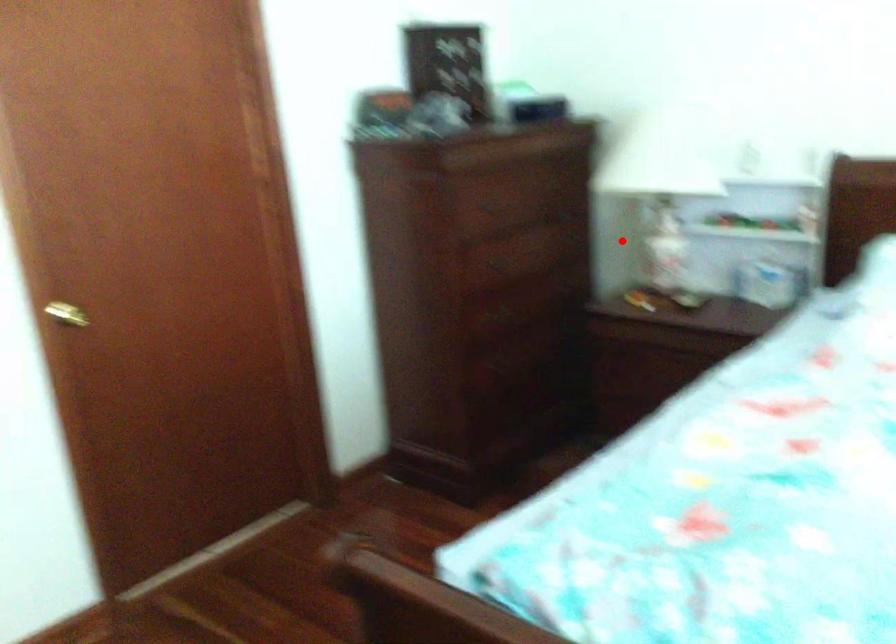
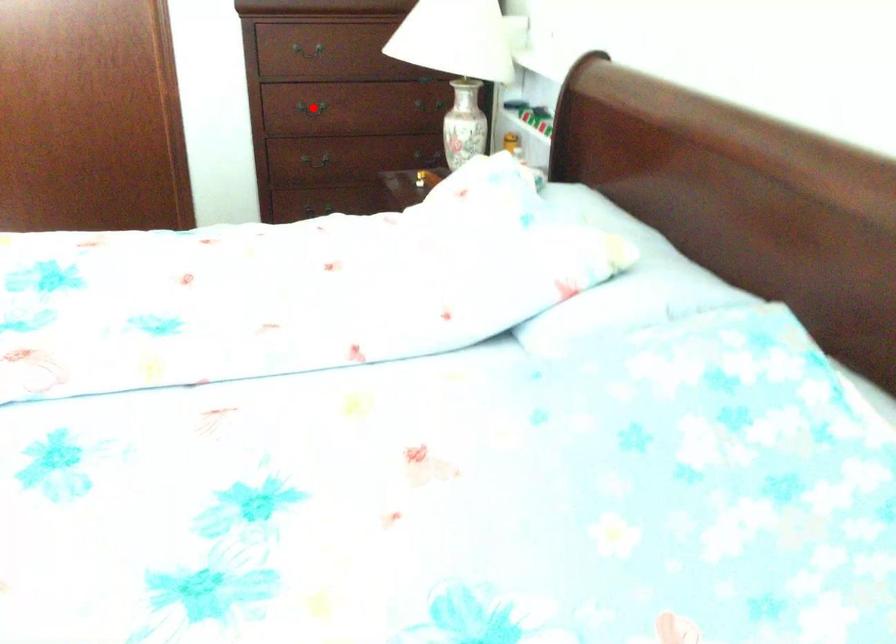
I am providing you with two images of the same scene from different viewpoints. A red point is marked on the first image and another point is marked on the second image. Is the red point in image1 aligned with the point shown in image2?

No